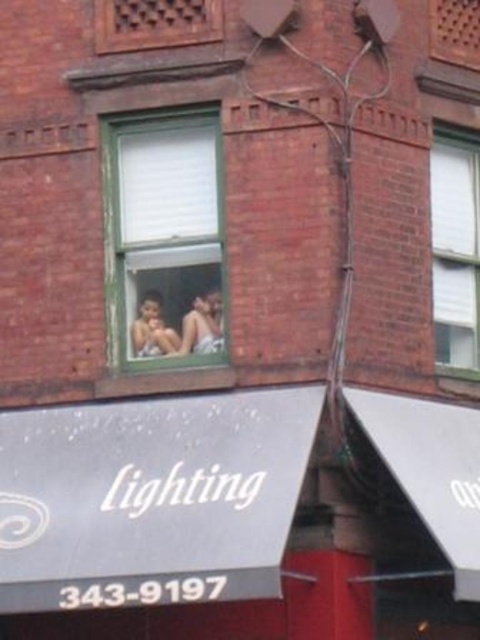
Can you confirm if white matte window at upper right is positioned to the left of matte brown wooden window at upper center?

Incorrect, white matte window at upper right is not on the left side of matte brown wooden window at upper center.

Does white matte window at upper right have a greater width compared to matte brown wooden window at upper center?

No, white matte window at upper right is not wider than matte brown wooden window at upper center.

The width and height of the screenshot is (480, 640). Find the location of `white matte window at upper right`. white matte window at upper right is located at coordinates pos(456,250).

Does green wooden window at center come in front of matte brown wooden window at upper center?

No, it is behind matte brown wooden window at upper center.

Does point (214, 168) come closer to viewer compared to point (210, 20)?

No.

Which is behind, point (148, 266) or point (156, 20)?

The point (148, 266) is behind.

Where is `green wooden window at center`? The image size is (480, 640). green wooden window at center is located at coordinates (163, 237).

Who is lower down, green wooden window at center or white matte window at upper right?

white matte window at upper right

What are the coordinates of `green wooden window at center` in the screenshot? It's located at (163, 237).